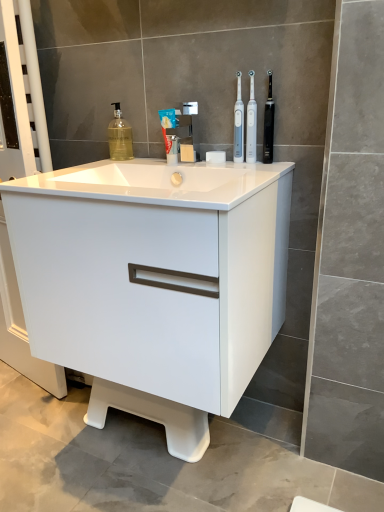
At what (x,y) coordinates should I click in order to perform the action: click on free space that is in between white plastic toothbrush at center, which appears as the 3th toothbrush when viewed from the right, and chrome metallic faucet at upper center. Please return your answer as a coordinate pair (x, y). The image size is (384, 512). Looking at the image, I should click on (210, 166).